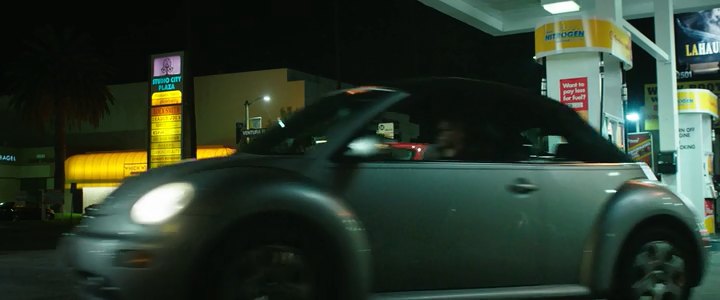
You are a GUI agent. You are given a task and a screenshot of the screen. Output one action in this format:
    pyautogui.click(x=<x>, y=<y>)
    Task: Click on the door handle
    Image resolution: width=720 pixels, height=300 pixels.
    Given the screenshot: What is the action you would take?
    pyautogui.click(x=525, y=186)